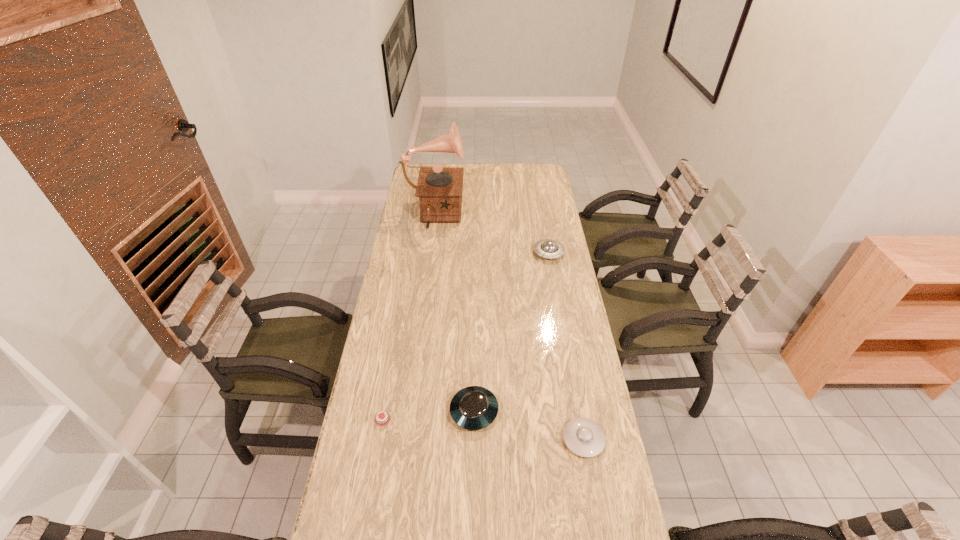
Find the location of a particular element. vacant space located 0.120m on the right of the chocolate cake is located at coordinates (438, 419).

Image resolution: width=960 pixels, height=540 pixels. In order to click on record player at the left edge in this screenshot , I will do `click(439, 189)`.

What are the coordinates of `chocolate cake that is at the left edge` in the screenshot? It's located at (382, 419).

Image resolution: width=960 pixels, height=540 pixels. In order to click on vacant region at the far edge in this screenshot , I will do click(x=490, y=164).

Where is `free space at the left edge of the desktop`? free space at the left edge of the desktop is located at coordinates [397, 264].

Locate an element on the screen. The image size is (960, 540). vacant space at the right edge of the desktop is located at coordinates (562, 306).

Image resolution: width=960 pixels, height=540 pixels. In order to click on vacant space at the far right corner of the desktop in this screenshot , I will do `click(540, 166)`.

Where is `vacant space in between the leftmost saucer and the second farthest object`? Image resolution: width=960 pixels, height=540 pixels. vacant space in between the leftmost saucer and the second farthest object is located at coordinates (512, 332).

Locate an element on the screen. This screenshot has width=960, height=540. vacant area that lies between the shortest object and the leftmost saucer is located at coordinates (428, 415).

Image resolution: width=960 pixels, height=540 pixels. I want to click on vacant space that is in between the farthest saucer and the leftmost saucer, so click(512, 332).